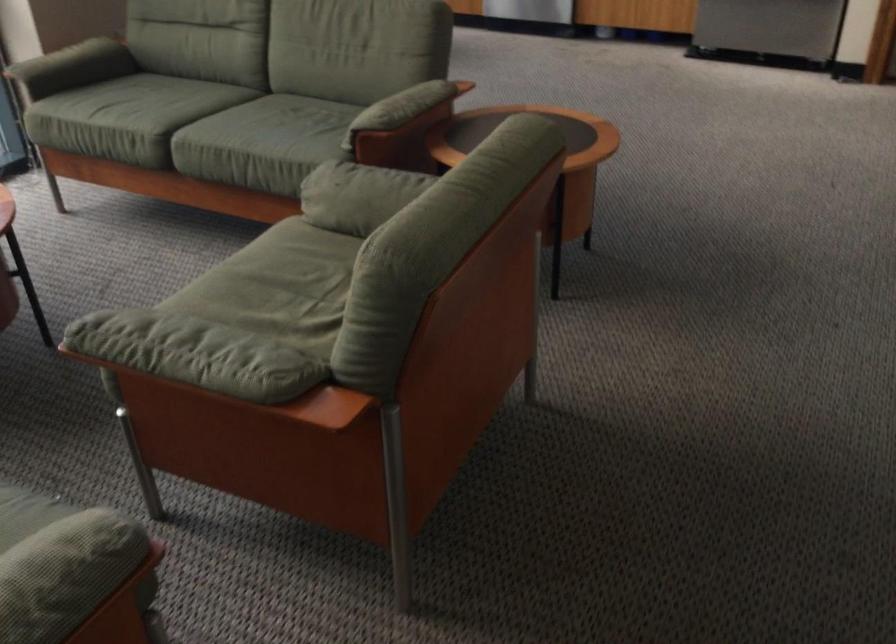
The width and height of the screenshot is (896, 644). What are the coordinates of `green chair sitting surface` in the screenshot? It's located at (289, 260).